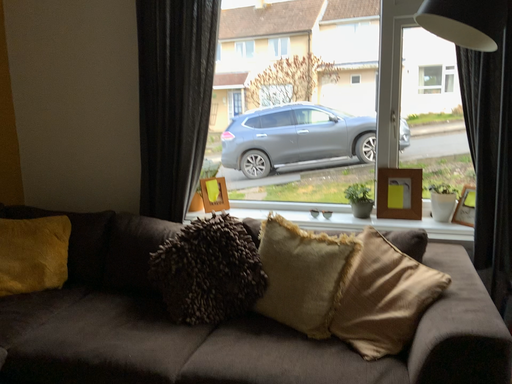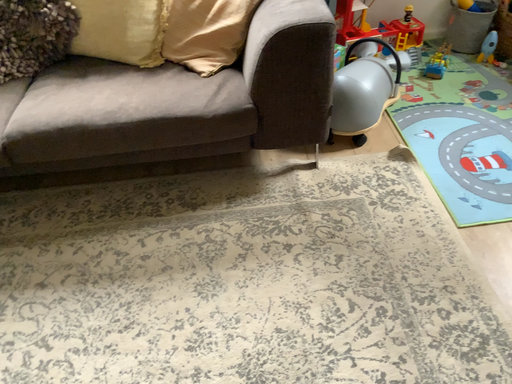
Question: How did the camera likely rotate when shooting the video?

Choices:
 (A) rotated upward
 (B) rotated downward

Answer: (B)